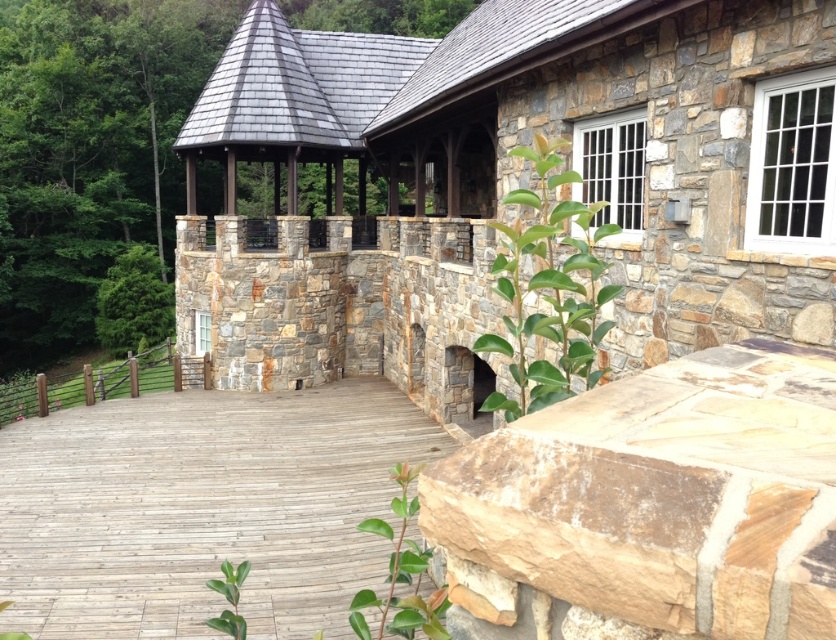
Question: Is natural stone gazebo at center bigger than wooden deck at center?

Choices:
 (A) no
 (B) yes

Answer: (B)

Question: Does natural stone wall at center have a larger size compared to wooden deck at center?

Choices:
 (A) yes
 (B) no

Answer: (B)

Question: Estimate the real-world distances between objects in this image. Which object is closer to the wooden deck at center?

Choices:
 (A) natural stone gazebo at center
 (B) natural stone wall at center

Answer: (A)

Question: Can you confirm if natural stone gazebo at center is wider than wooden deck at center?

Choices:
 (A) no
 (B) yes

Answer: (B)

Question: Which point appears closest to the camera in this image?

Choices:
 (A) (832, 618)
 (B) (97, 548)
 (C) (233, 157)

Answer: (A)

Question: Which point is closer to the camera taking this photo?

Choices:
 (A) (202, 576)
 (B) (669, 563)

Answer: (B)